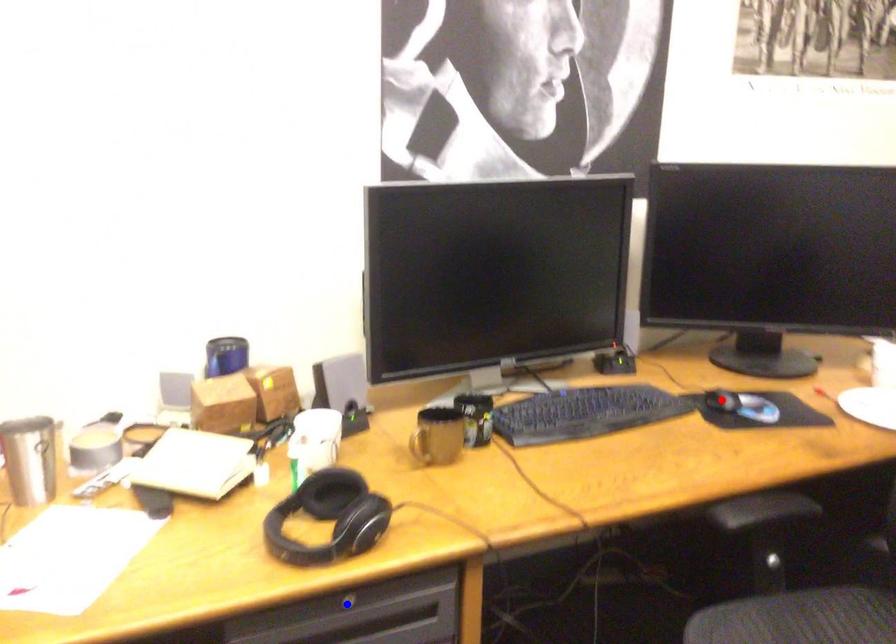
Question: Two points are marked on the image. Which point is closer to the camera?

Choices:
 (A) Blue point is closer.
 (B) Red point is closer.

Answer: (A)